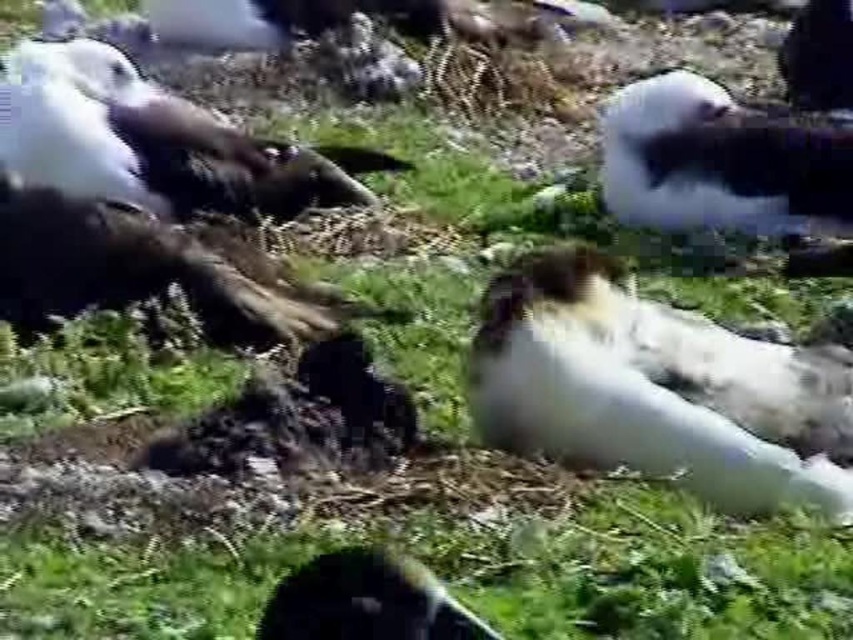
Question: In this image, where is white fluffy bird at center located relative to white fluffy bird at upper right?

Choices:
 (A) below
 (B) above

Answer: (A)

Question: Which object is closer to the camera taking this photo?

Choices:
 (A) white fluffy mollymawk at lower center
 (B) white fluffy bird at upper left
 (C) white fluffy bird at upper right

Answer: (A)

Question: Can you confirm if white fluffy bird at center is positioned below white fluffy bird at upper right?

Choices:
 (A) yes
 (B) no

Answer: (A)

Question: Does white fluffy bird at upper left have a larger size compared to white fluffy mollymawk at lower center?

Choices:
 (A) yes
 (B) no

Answer: (A)

Question: Among these points, which one is farthest from the camera?

Choices:
 (A) (639, 136)
 (B) (787, 406)
 (C) (279, 592)

Answer: (A)

Question: Which of the following is the farthest from the observer?

Choices:
 (A) white fluffy bird at center
 (B) white fluffy bird at upper left

Answer: (B)